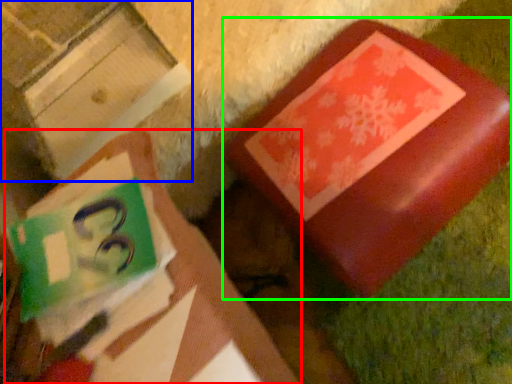
Question: Which object is positioned farthest from book (highlighted by a red box)? Select from cardboard box (highlighted by a blue box) and furniture (highlighted by a green box).

Choices:
 (A) cardboard box
 (B) furniture

Answer: (A)